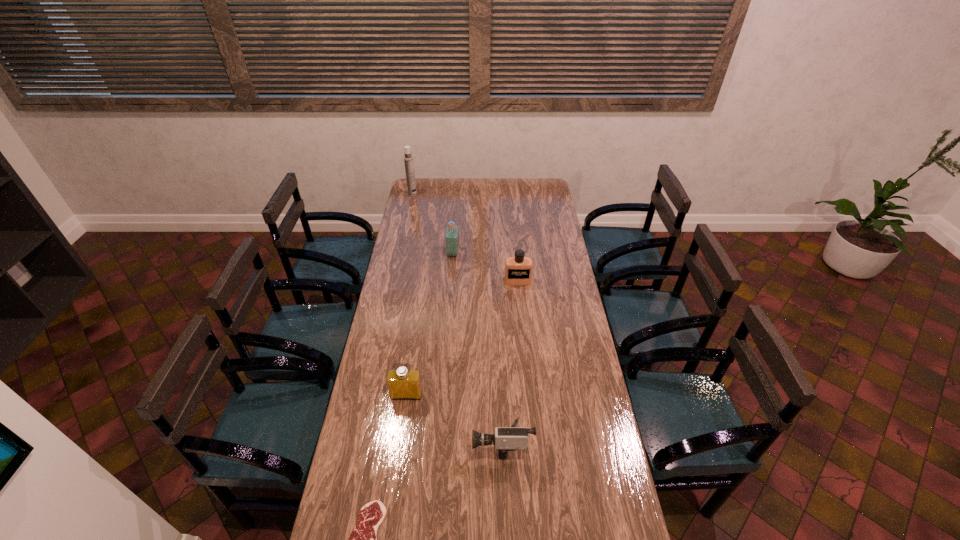
Identify the location of the tallest object. The image size is (960, 540). (408, 158).

Image resolution: width=960 pixels, height=540 pixels. I want to click on the farthest object, so click(x=408, y=158).

Identify the location of the fourth object from left to right. The image size is (960, 540). (452, 231).

In order to click on the fifth nearest object in this screenshot , I will do `click(452, 231)`.

Identify the location of the third farthest object. The height and width of the screenshot is (540, 960). (518, 270).

I want to click on the second farthest perfume, so click(518, 270).

Identify the location of the fourth farthest object. The image size is (960, 540). (403, 383).

You are a GUI agent. You are given a task and a screenshot of the screen. Output one action in this format:
    pyautogui.click(x=<x>, y=<y>)
    Task: Click on the leftmost perfume
    The image size is (960, 540).
    Given the screenshot: What is the action you would take?
    pyautogui.click(x=403, y=383)

Where is `camcorder`? camcorder is located at coordinates pyautogui.click(x=513, y=438).

This screenshot has height=540, width=960. I want to click on free space located on the right of the tallest object, so click(472, 194).